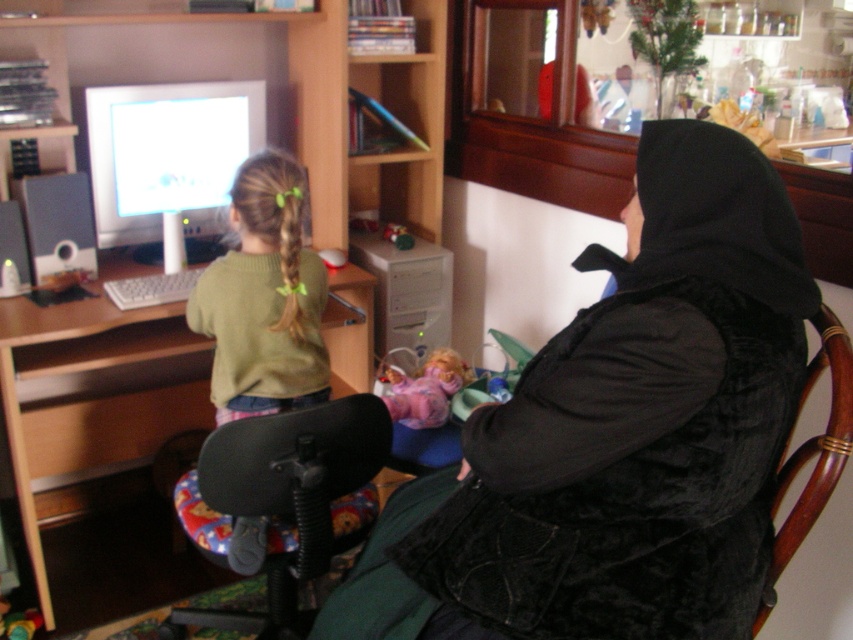
Does black velvet vest at center come in front of wooden desk at lower left?

Yes, it is.

Who is higher up, black velvet vest at center or wooden desk at lower left?

black velvet vest at center is higher up.

Which is behind, point (701, 308) or point (109, 513)?

Point (109, 513)

The height and width of the screenshot is (640, 853). I want to click on black velvet vest at center, so click(x=619, y=435).

Is wooden desk at lower left smaller than black plastic swivel chair at lower left?

Actually, wooden desk at lower left might be larger than black plastic swivel chair at lower left.

Is point (169, 554) positioned before point (247, 508)?

No.

Locate an element on the screen. wooden desk at lower left is located at coordinates (100, 445).

Identify the location of wooden desk at lower left. (100, 445).

Who is positioned more to the right, green sweater at left or wooden chair at right?

Positioned to the right is wooden chair at right.

From the picture: Can you confirm if green sweater at left is wider than wooden chair at right?

Indeed, green sweater at left has a greater width compared to wooden chair at right.

Identify the location of green sweater at left. (264, 298).

At what (x,y) coordinates should I click in order to perform the action: click on green sweater at left. Please return your answer as a coordinate pair (x, y). This screenshot has height=640, width=853. Looking at the image, I should click on (264, 298).